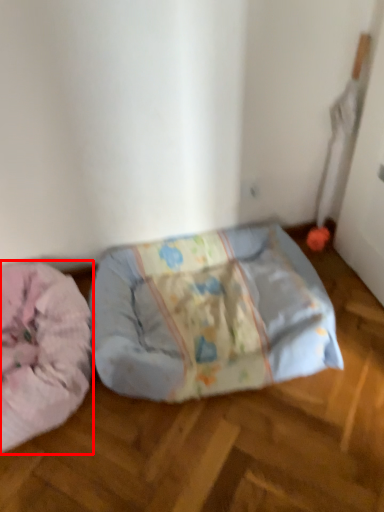
Question: From the image's perspective, where is dog bed (annotated by the red box) located in relation to furniture in the image?

Choices:
 (A) below
 (B) above

Answer: (A)